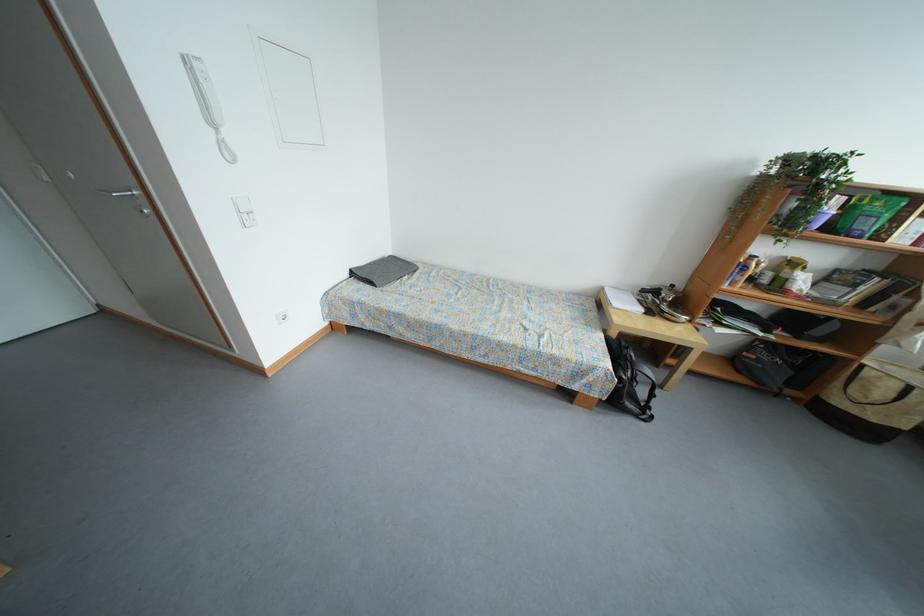
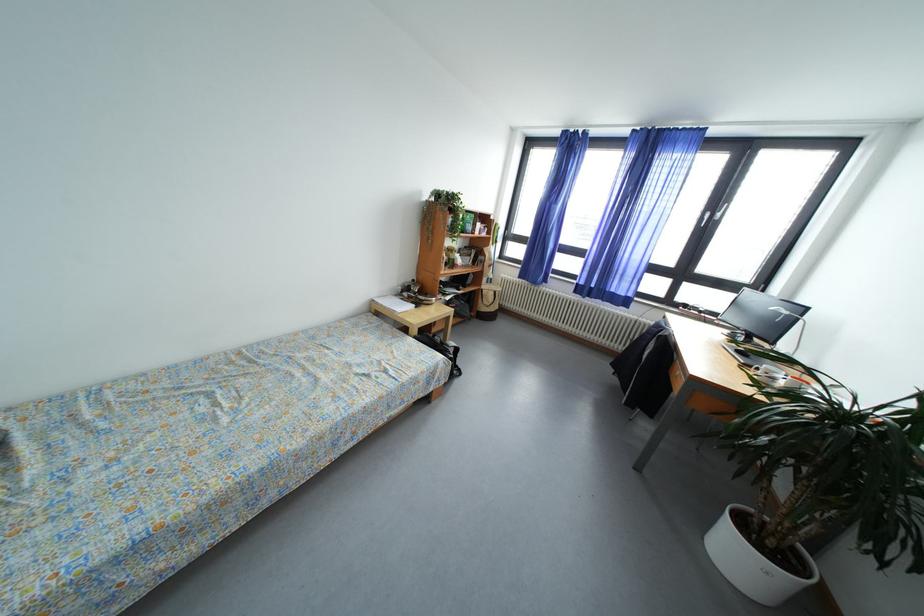
In the second image, find the point that corresponds to pixel 619 339 in the first image.

(421, 337)